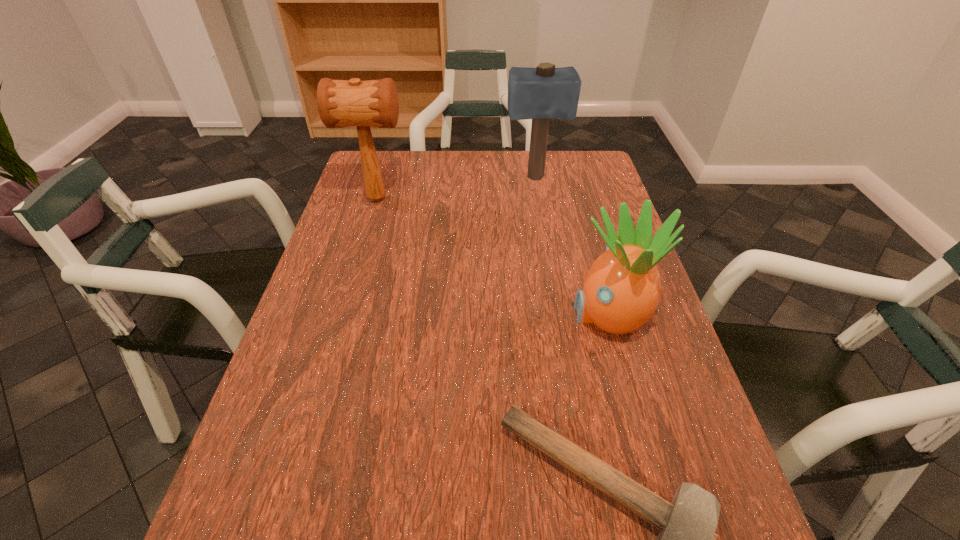
What are the coordinates of `object that is at the far left corner` in the screenshot? It's located at (341, 103).

Where is `object positioned at the far right corner`? object positioned at the far right corner is located at coordinates (544, 92).

Identify the location of free space at the far edge. (510, 177).

Locate an element on the screen. This screenshot has height=540, width=960. free space at the left edge of the desktop is located at coordinates (375, 219).

I want to click on free space at the right edge of the desktop, so click(586, 208).

Find the location of a particular element. This screenshot has height=540, width=960. vacant point located between the pineapple and the leftmost mallet is located at coordinates (492, 256).

Where is `empty space that is in between the second nearest object and the leftmost mallet`? This screenshot has height=540, width=960. empty space that is in between the second nearest object and the leftmost mallet is located at coordinates (492, 256).

This screenshot has width=960, height=540. What are the coordinates of `vacant region between the leftmost object and the second shortest object` in the screenshot? It's located at (492, 256).

Point out which object is positioned as the third nearest to the leftmost mallet. Please provide its 2D coordinates. Your answer should be formatted as a tuple, i.e. [(x, y)], where the tuple contains the x and y coordinates of a point satisfying the conditions above.

[(687, 538)]

Identify which object is the third closest to the nearest mallet. Please provide its 2D coordinates. Your answer should be formatted as a tuple, i.e. [(x, y)], where the tuple contains the x and y coordinates of a point satisfying the conditions above.

[(544, 92)]